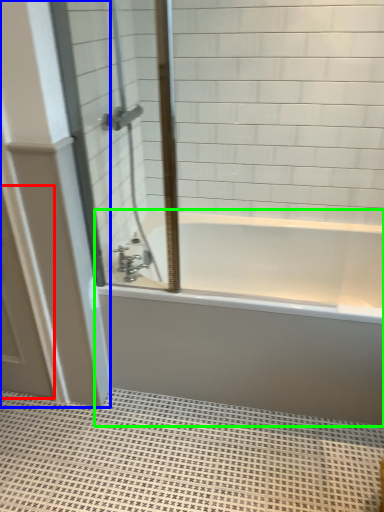
Question: Based on their relative distances, which object is nearer to screen door (highlighted by a red box)? Choose from door (highlighted by a blue box) and bathtub (highlighted by a green box).

Choices:
 (A) door
 (B) bathtub

Answer: (A)